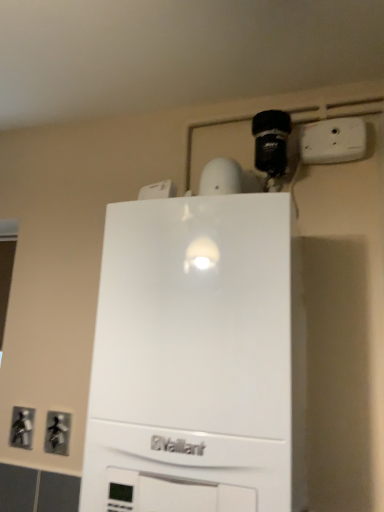
Question: Is metallic silver outlet at lower left, the 3th electric outlet from the right, bigger than white plastic electric outlet at upper center, arranged as the 1th electric outlet when viewed from the top?

Choices:
 (A) no
 (B) yes

Answer: (A)

Question: Can you confirm if metallic silver outlet at lower left, the 3th electric outlet from the right, is taller than white plastic electric outlet at upper center, which ranks as the third electric outlet in bottom-to-top order?

Choices:
 (A) no
 (B) yes

Answer: (B)

Question: Does metallic silver outlet at lower left, which is counted as the 1th electric outlet, starting from the bottom, appear on the left side of white plastic electric outlet at upper center, which ranks as the third electric outlet in bottom-to-top order?

Choices:
 (A) yes
 (B) no

Answer: (A)

Question: Is metallic silver outlet at lower left, acting as the 1th electric outlet starting from the back, far away from white plastic electric outlet at upper center, the third electric outlet when ordered from left to right?

Choices:
 (A) no
 (B) yes

Answer: (B)

Question: Is metallic silver outlet at lower left, positioned as the first electric outlet in left-to-right order, oriented towards white plastic electric outlet at upper center, the 1th electric outlet positioned from the right?

Choices:
 (A) yes
 (B) no

Answer: (B)

Question: Is white matte vaillant boiler at center wider or thinner than metallic silver outlet at lower left, the 3th electric outlet from the top?

Choices:
 (A) wide
 (B) thin

Answer: (A)

Question: From the image's perspective, relative to metallic silver outlet at lower left, acting as the 1th electric outlet starting from the back, is white matte vaillant boiler at center above or below?

Choices:
 (A) above
 (B) below

Answer: (A)

Question: From a real-world perspective, is white matte vaillant boiler at center positioned above or below metallic silver outlet at lower left, the third electric outlet in the front-to-back sequence?

Choices:
 (A) below
 (B) above

Answer: (B)

Question: Considering their positions, is white matte vaillant boiler at center located in front of or behind metallic silver outlet at lower left, the 3th electric outlet from the right?

Choices:
 (A) front
 (B) behind

Answer: (A)

Question: Considering their positions, is white plastic electric outlet at upper center, which ranks as the third electric outlet in bottom-to-top order, located in front of or behind metallic gray outlet at lower left, which is counted as the second electric outlet, starting from the top?

Choices:
 (A) front
 (B) behind

Answer: (A)

Question: From a real-world perspective, relative to metallic gray outlet at lower left, which appears as the 2th electric outlet when viewed from the front, is white plastic electric outlet at upper center, the first electric outlet positioned from the front, vertically above or below?

Choices:
 (A) below
 (B) above

Answer: (B)

Question: From the image's perspective, relative to metallic gray outlet at lower left, which is counted as the second electric outlet, starting from the right, is white plastic electric outlet at upper center, arranged as the 1th electric outlet when viewed from the top, above or below?

Choices:
 (A) below
 (B) above

Answer: (B)

Question: Looking at their shapes, would you say white plastic electric outlet at upper center, which is counted as the 3th electric outlet, starting from the back, is wider or thinner than metallic gray outlet at lower left, which is counted as the second electric outlet, starting from the top?

Choices:
 (A) wide
 (B) thin

Answer: (A)

Question: Is metallic gray outlet at lower left, which appears as the 2th electric outlet when viewed from the front, inside the boundaries of metallic silver outlet at lower left, which is counted as the 1th electric outlet, starting from the bottom, or outside?

Choices:
 (A) outside
 (B) inside

Answer: (A)

Question: Considering the positions of metallic gray outlet at lower left, arranged as the second electric outlet when ordered from the bottom, and metallic silver outlet at lower left, the 3th electric outlet from the top, in the image, is metallic gray outlet at lower left, arranged as the second electric outlet when ordered from the bottom, bigger or smaller than metallic silver outlet at lower left, the 3th electric outlet from the top,?

Choices:
 (A) big
 (B) small

Answer: (B)